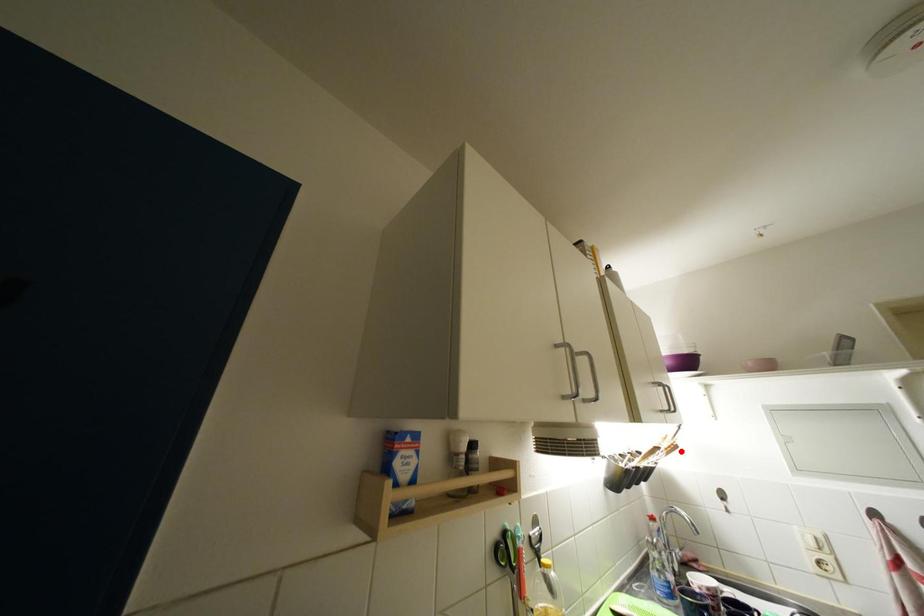
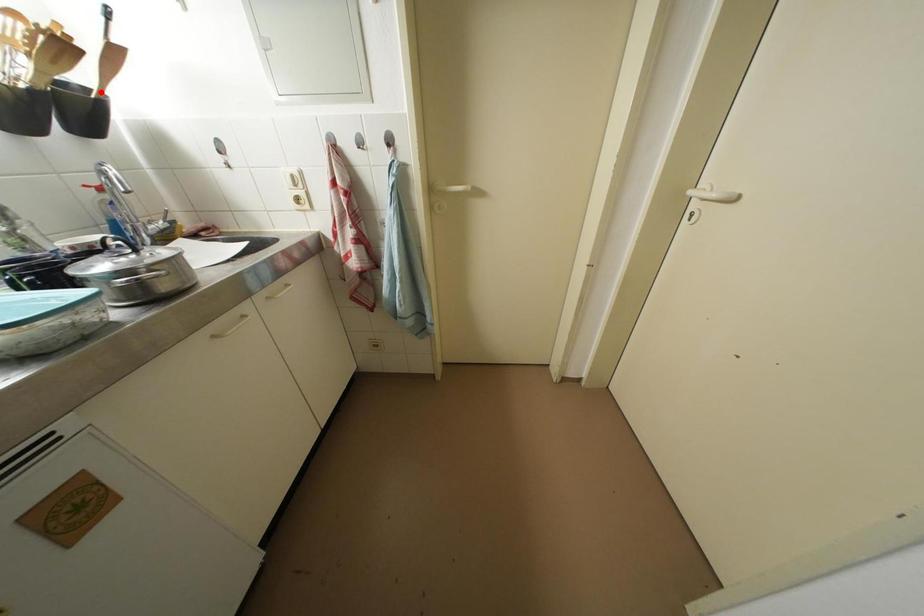
I am providing you with two images of the same scene from different viewpoints. A red point is marked on the first image and another point is marked on the second image. Are the points marked in image1 and image2 representing the same 3D position?

No